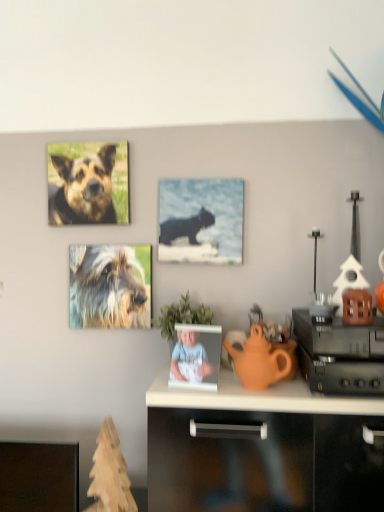
The width and height of the screenshot is (384, 512). I want to click on brown fur dog at upper left, arranged as the 2th dog when ordered from the bottom, so click(84, 189).

Measure the distance between brown fur dog at upper left, arranged as the 2th dog when ordered from the bottom, and camera.

brown fur dog at upper left, arranged as the 2th dog when ordered from the bottom, is 5.09 feet from camera.

This screenshot has width=384, height=512. I want to click on smooth plastic photo frame at center, so click(x=189, y=359).

Describe the element at coordinates (181, 317) in the screenshot. Image resolution: width=384 pixels, height=512 pixels. I see `green leafy plant at center` at that location.

Locate an element on the screen. The width and height of the screenshot is (384, 512). brown matte house at right is located at coordinates (357, 307).

What do you see at coordinates (110, 286) in the screenshot?
I see `fuzzy fur dog at center, which is counted as the 1th dog, starting from the bottom` at bounding box center [110, 286].

Looking at this image, measure the distance between point (x=301, y=351) and camera.

Point (x=301, y=351) is 4.06 feet away from camera.

What are the coordinates of `orange matte teapot at center` in the screenshot? It's located at (259, 361).

Is black plastic speaker at right positioned in front of smooth plastic photo frame at center?

That is True.

Would you say black plastic speaker at right is outside smooth plastic photo frame at center?

Yes, black plastic speaker at right is outside of smooth plastic photo frame at center.

In the scene shown: Does black plastic speaker at right turn towards smooth plastic photo frame at center?

No, black plastic speaker at right is not turned towards smooth plastic photo frame at center.

Image resolution: width=384 pixels, height=512 pixels. Find the location of `person located below the black plastic speaker at right (from the image's perspective)`. person located below the black plastic speaker at right (from the image's perspective) is located at coordinates (189, 359).

Does point (254, 388) lie in front of point (212, 368)?

Yes, it is.

Identify the location of person lying behind the orange matte teapot at center. This screenshot has height=512, width=384. (189, 359).

Based on their positions, is orange matte teapot at center located to the left or right of smooth plastic photo frame at center?

orange matte teapot at center is positioned on smooth plastic photo frame at center's right side.

Which of these two, orange matte teapot at center or smooth plastic photo frame at center, is bigger?

orange matte teapot at center.

Consider the image. Is black plastic speaker at right in front of or behind brown matte house at right in the image?

In the image, black plastic speaker at right appears in front of brown matte house at right.

Is black plastic speaker at right oriented towards brown matte house at right?

No, black plastic speaker at right is not aimed at brown matte house at right.

Which is closer, [367,357] or [344,318]?

Point [367,357]

From a real-world perspective, is smooth plastic photo frame at center above or below orange matte teapot at center?

smooth plastic photo frame at center is below orange matte teapot at center.

Find the location of a particular element. The image size is (384, 512). teapot in front of the smooth plastic photo frame at center is located at coordinates (259, 361).

Could you tell me if smooth plastic photo frame at center is facing orange matte teapot at center?

No, smooth plastic photo frame at center is not turned towards orange matte teapot at center.

Does smooth plastic photo frame at center have a greater width compared to orange matte teapot at center?

Correct, the width of smooth plastic photo frame at center exceeds that of orange matte teapot at center.

From the image's perspective, is matte black cat at center above or below brown matte house at right?

From the image's perspective, matte black cat at center appears above brown matte house at right.

Between matte black cat at center and brown matte house at right, which one has smaller width?

matte black cat at center.

The height and width of the screenshot is (512, 384). I want to click on toy that is in front of the matte black cat at center, so click(357, 307).

Which is more to the left, matte black cat at center or brown matte house at right?

Positioned to the left is matte black cat at center.

Could you tell me if orange matte teapot at center is facing brown fur dog at upper left, arranged as the 2th dog when ordered from the bottom?

No, orange matte teapot at center is not oriented towards brown fur dog at upper left, arranged as the 2th dog when ordered from the bottom.

From a real-world perspective, is orange matte teapot at center on top of brown fur dog at upper left, arranged as the 2th dog when ordered from the bottom?

No.

Does point (262, 349) appear closer or farther from the camera than point (85, 209)?

Point (262, 349) is closer to the camera than point (85, 209).

Considering the positions of objects orange matte teapot at center and brown fur dog at upper left, arranged as the 2th dog when ordered from the bottom, in the image provided, who is more to the right, orange matte teapot at center or brown fur dog at upper left, arranged as the 2th dog when ordered from the bottom,?

orange matte teapot at center.

Is brown matte house at right inside the boundaries of matte black cat at center, or outside?

brown matte house at right is outside matte black cat at center.

Consider the image. Who is smaller, brown matte house at right or matte black cat at center?

With smaller size is brown matte house at right.

Can you see brown matte house at right touching matte black cat at center?

No.

Identify the location of picture frame lying behind the brown matte house at right. The height and width of the screenshot is (512, 384). (201, 221).

Identify the location of person below the black plastic speaker at right (from the image's perspective). The image size is (384, 512). (189, 359).

At what (x,y) coordinates should I click in order to perform the action: click on teapot on the right side of smooth plastic photo frame at center. Please return your answer as a coordinate pair (x, y). Looking at the image, I should click on (259, 361).

Which object lies nearer to the anchor point brown fur dog at upper left, arranged as the 2th dog when ordered from the bottom, fuzzy fur dog at center, which is counted as the 1th dog, starting from the bottom, or smooth plastic photo frame at center?

fuzzy fur dog at center, which is counted as the 1th dog, starting from the bottom, lies closer to brown fur dog at upper left, arranged as the 2th dog when ordered from the bottom, than the other object.

Looking at the image, which one is located further to brown matte house at right, black plastic speaker at right or smooth plastic photo frame at center?

smooth plastic photo frame at center.

Looking at the image, which one is located further to brown fur dog at upper left, placed as the first dog when sorted from top to bottom, green leafy plant at center or fuzzy fur dog at center, which is counted as the 1th dog, starting from the bottom?

Among the two, green leafy plant at center is located further to brown fur dog at upper left, placed as the first dog when sorted from top to bottom.

Looking at the image, which one is located further to orange matte teapot at center, smooth plastic photo frame at center or fuzzy fur dog at center, arranged as the second dog when viewed from the top?

fuzzy fur dog at center, arranged as the second dog when viewed from the top, is further to orange matte teapot at center.

When comparing their distances from matte black cat at center, does brown fur dog at upper left, arranged as the 2th dog when ordered from the bottom, or orange matte teapot at center seem further?

orange matte teapot at center is positioned further to the anchor matte black cat at center.

Considering their positions, is brown matte house at right positioned further to green leafy plant at center than matte black cat at center?

brown matte house at right.

Which object lies nearer to the anchor point brown matte house at right, smooth plastic photo frame at center or brown fur dog at upper left, arranged as the 2th dog when ordered from the bottom?

smooth plastic photo frame at center.

Based on their spatial positions, is black plastic speaker at right or fuzzy fur dog at center, which is counted as the 1th dog, starting from the bottom, further from smooth plastic photo frame at center?

fuzzy fur dog at center, which is counted as the 1th dog, starting from the bottom, is positioned further to the anchor smooth plastic photo frame at center.

You are a GUI agent. You are given a task and a screenshot of the screen. Output one action in this format:
    pyautogui.click(x=<x>, y=<y>)
    Task: Click on the dog between brown fur dog at upper left, placed as the first dog when sorted from top to bottom, and orange matte teapot at center from left to right
    Image resolution: width=384 pixels, height=512 pixels.
    Given the screenshot: What is the action you would take?
    pyautogui.click(x=110, y=286)

Locate an element on the screen. Image resolution: width=384 pixels, height=512 pixels. teapot between smooth plastic photo frame at center and brown matte house at right from left to right is located at coordinates (259, 361).

Find the location of `toy between matte black cat at center and black plastic speaker at right in the horizontal direction`. toy between matte black cat at center and black plastic speaker at right in the horizontal direction is located at coordinates coord(357,307).

The height and width of the screenshot is (512, 384). In order to click on toy between smooth plastic photo frame at center and black plastic speaker at right in this screenshot , I will do `click(357, 307)`.